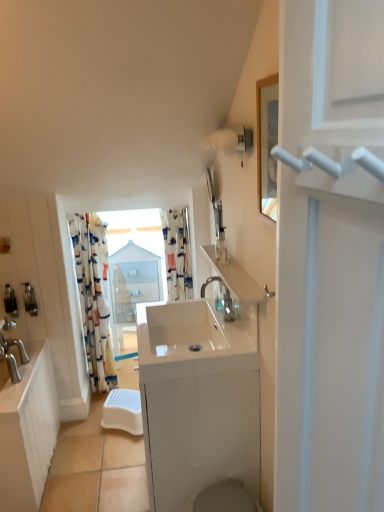
This screenshot has height=512, width=384. In order to click on vacant area on top of floral fabric curtain at center, arranged as the second curtain when viewed from the right (from a real-world perspective) in this screenshot , I will do `click(94, 209)`.